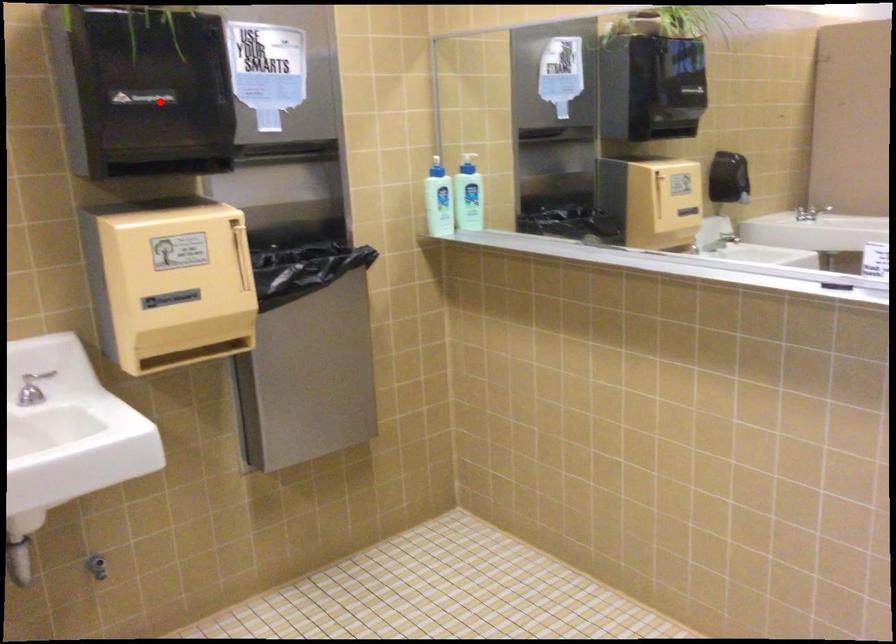
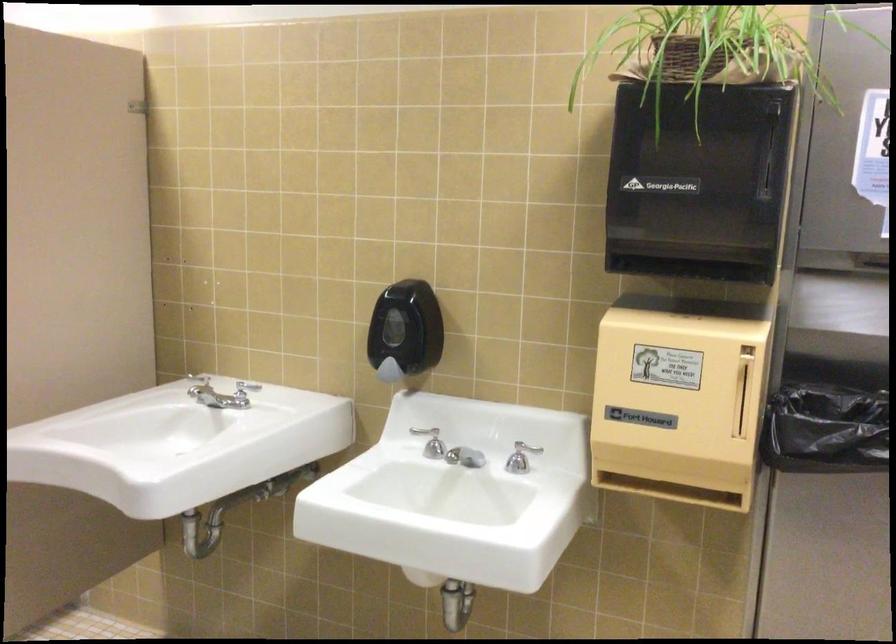
Question: I am providing you with two images of the same scene from different viewpoints. In image1, a red point is highlighted. Considering the same 3D point in image2, which of the following is correct?

Choices:
 (A) It is closer
 (B) It is farther

Answer: (A)